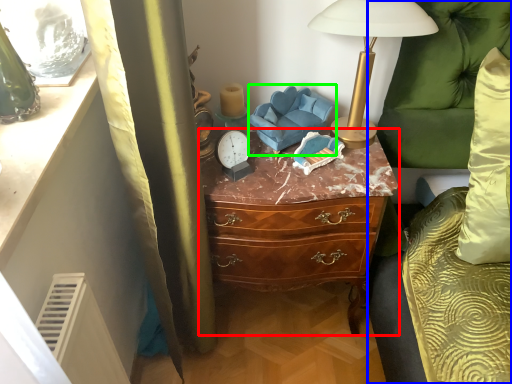
Question: Considering the real-world distances, which object is farthest from chest of drawers (highlighted by a red box)? couch (highlighted by a blue box) or swivel chair (highlighted by a green box)?

Choices:
 (A) couch
 (B) swivel chair

Answer: (A)